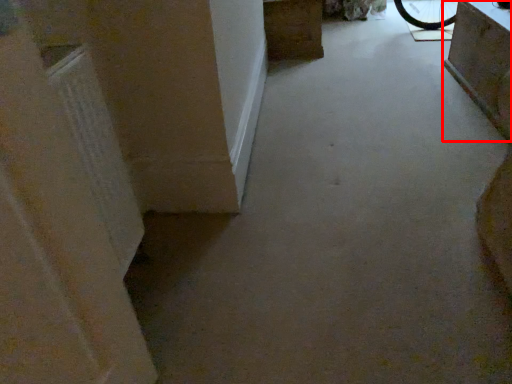
Question: From the image's perspective, what is the correct spatial positioning of furniture (annotated by the red box) in reference to furniture?

Choices:
 (A) above
 (B) below

Answer: (B)